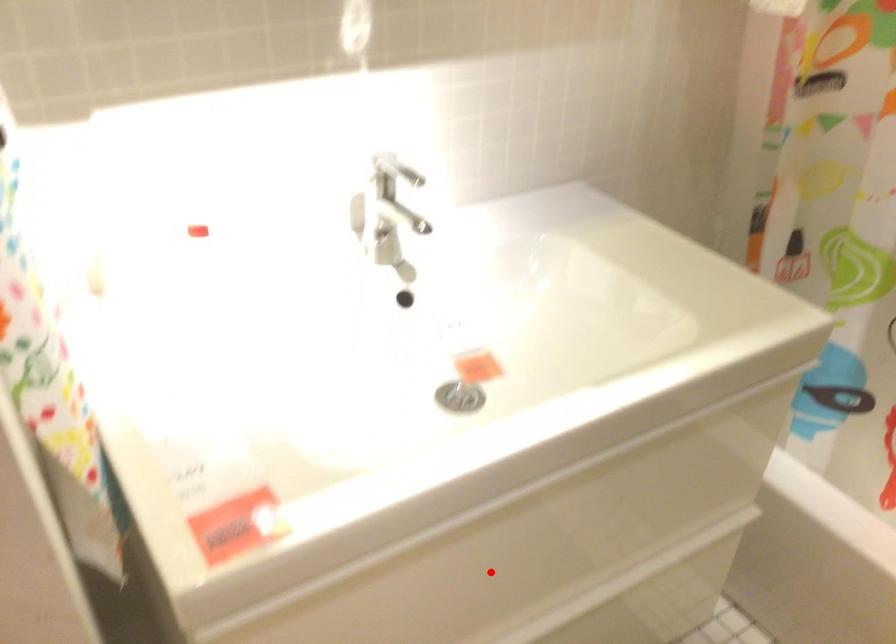
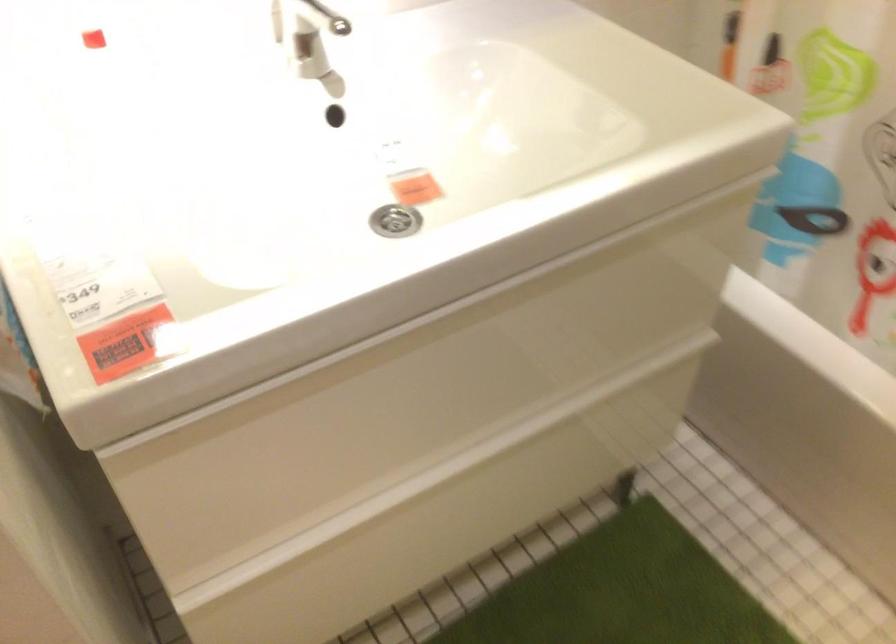
In the second image, find the point that corresponds to the highlighted location in the first image.

(423, 392)